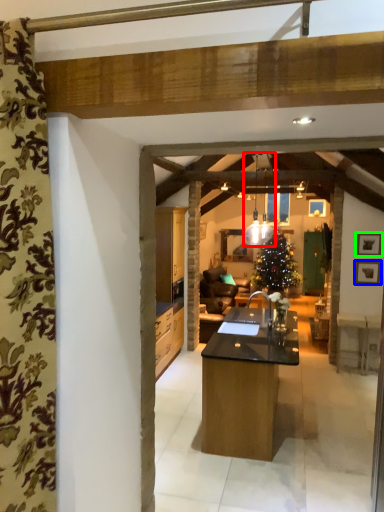
Question: Which is farther away from light fixture (highlighted by a red box)? picture frame (highlighted by a blue box) or picture frame (highlighted by a green box)?

Choices:
 (A) picture frame
 (B) picture frame

Answer: (A)